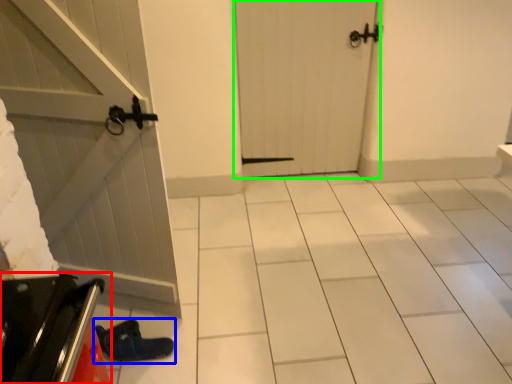
Question: Which object is positioned farthest from appliance (highlighted by a red box)? Select from footwear (highlighted by a blue box) and door (highlighted by a green box).

Choices:
 (A) footwear
 (B) door

Answer: (B)